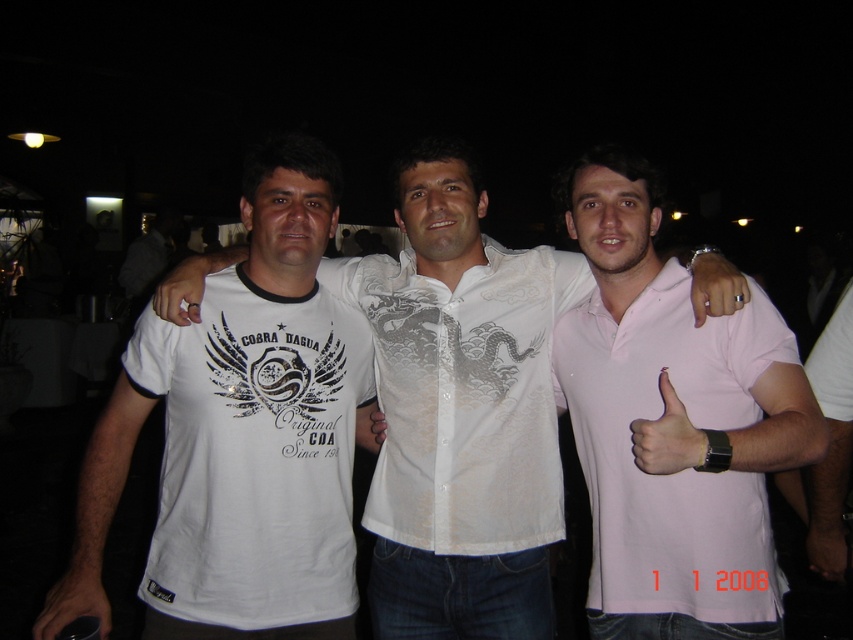
What is located at the coordinates point (677, 472) in the image?

The point (677, 472) indicates the pink cotton polo at center.

You are a photographer adjusting your camera settings to capture the three men in the scene. You notice the pink cotton polo at center and the silver metallic ring at center. Which object should you focus on first if you want to ensure both are in sharp focus?

The pink cotton polo at center is much taller than the silver metallic ring at center, so focusing on the taller object first would help ensure both are in sharp focus.